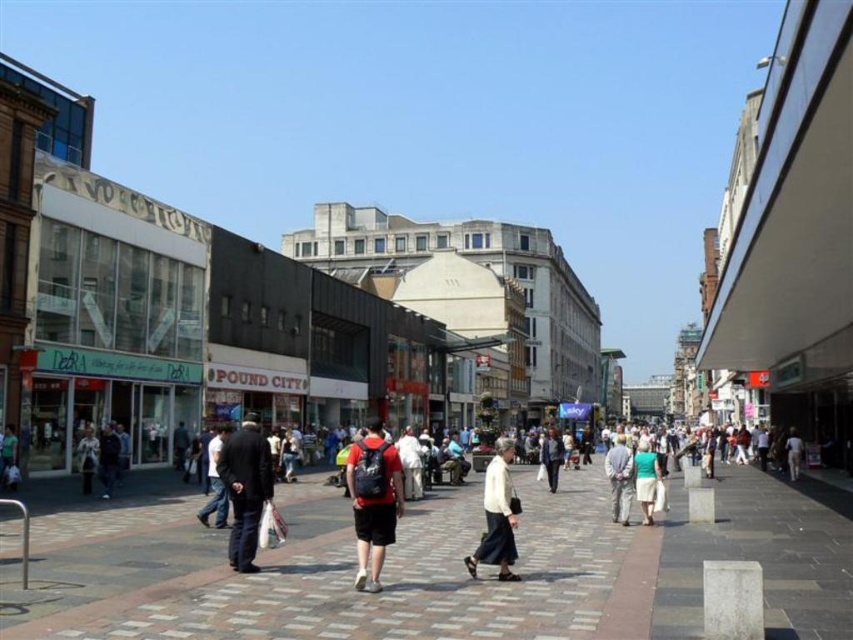
Based on the photo, is white cotton skirt at center bigger than dark blue jeans at center?

Yes.

Who is more distant from viewer, (498, 468) or (798, 464)?

Point (798, 464)

Does point (509, 504) come farther from viewer compared to point (799, 460)?

No, it is in front of (799, 460).

The width and height of the screenshot is (853, 640). In order to click on white cotton skirt at center in this screenshot , I will do `click(497, 515)`.

Between point (508, 461) and point (621, 445), which one is positioned behind?

Positioned behind is point (621, 445).

In the scene shown: Measure the distance from white cotton skirt at center to light gray fabric pants at center.

white cotton skirt at center and light gray fabric pants at center are 43.15 feet apart from each other.

Which is in front, point (490, 560) or point (618, 474)?

Positioned in front is point (490, 560).

Find the location of a particular element. The height and width of the screenshot is (640, 853). white cotton skirt at center is located at coordinates (497, 515).

Looking at this image, does paved stone pavement at center come in front of dark blue jeans at center?

Yes, it is in front of dark blue jeans at center.

Does paved stone pavement at center have a lesser height compared to dark blue jeans at center?

Indeed, paved stone pavement at center has a lesser height compared to dark blue jeans at center.

Identify the location of paved stone pavement at center. (514, 568).